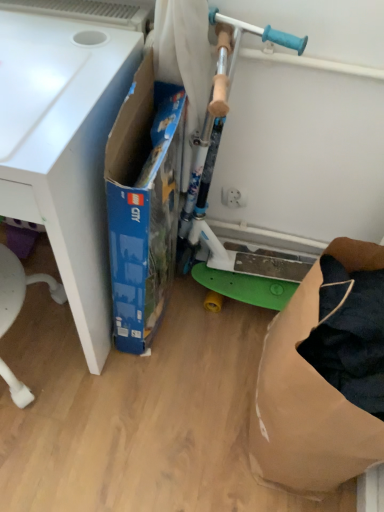
Image resolution: width=384 pixels, height=512 pixels. What are the coordinates of `vacant space that's between blue cardboard box at center and green plastic scooter at center` in the screenshot? It's located at (201, 336).